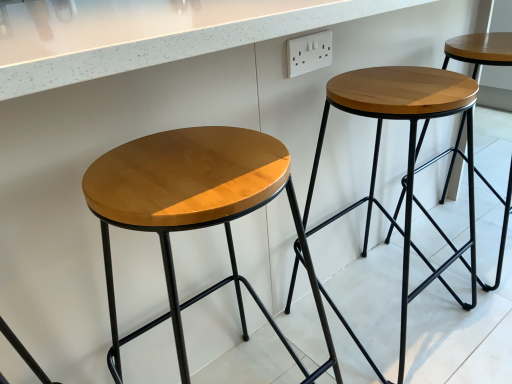
In order to click on free space above wooden stool at center, the second stool when ordered from left to right (from a real-world perspective) in this screenshot , I will do `click(410, 86)`.